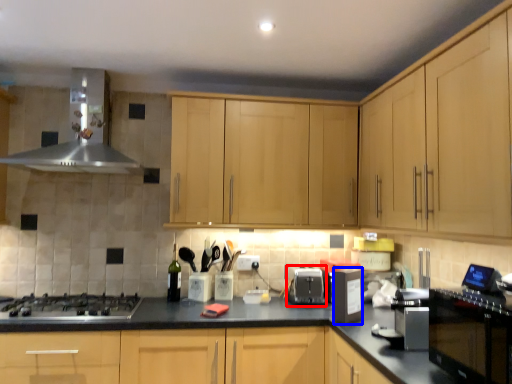
Question: Among these objects, which one is nearest to the camera, appliance (highlighted by a red box) or appliance (highlighted by a blue box)?

Choices:
 (A) appliance
 (B) appliance

Answer: (B)